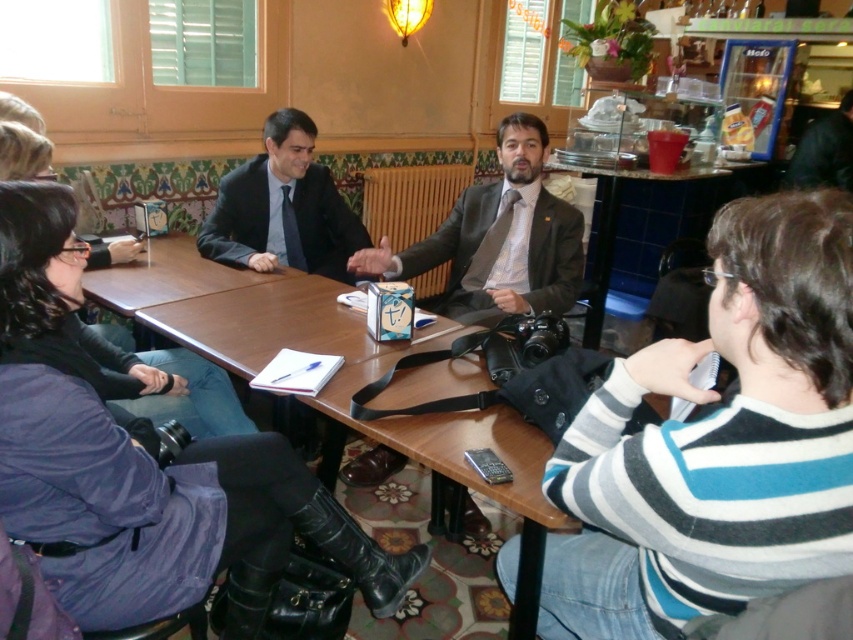
Question: Where is dark gray suit at center located in relation to brown textured suit at center in the image?

Choices:
 (A) above
 (B) below

Answer: (A)

Question: Considering the real-world distances, which object is farthest from the matte black suit at center?

Choices:
 (A) matte purple coat at lower left
 (B) dark gray suit at center

Answer: (A)

Question: Which point is farther to the camera?

Choices:
 (A) matte black suit at center
 (B) matte purple coat at lower left
 (C) brown textured suit at center
 (D) dark gray suit at center

Answer: (D)

Question: Which of the following is the closest to the observer?

Choices:
 (A) brown textured suit at center
 (B) matte purple coat at lower left
 (C) dark gray suit at center
 (D) matte black suit at center

Answer: (B)

Question: Can you confirm if matte black suit at center is smaller than dark gray suit at center?

Choices:
 (A) no
 (B) yes

Answer: (A)

Question: Does matte purple coat at lower left have a greater width compared to dark gray suit at center?

Choices:
 (A) yes
 (B) no

Answer: (A)